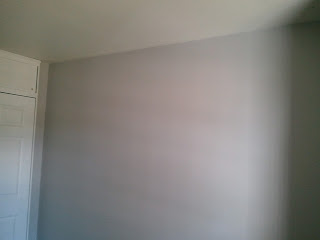
Locate an element on the screen. This screenshot has height=240, width=320. piece of panel is located at coordinates (10, 228).